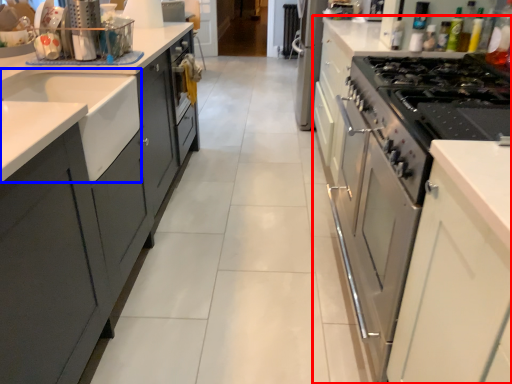
Question: Which of the following is the closest to the observer, cabinetry (highlighted by a red box) or sink (highlighted by a blue box)?

Choices:
 (A) cabinetry
 (B) sink

Answer: (A)